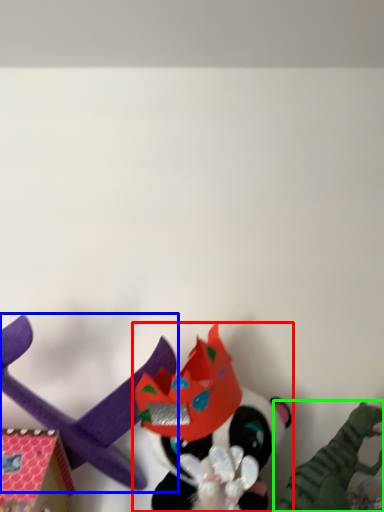
Question: Considering the real-world distances, which object is closest to toy (highlighted by a red box)? toy (highlighted by a blue box) or toy (highlighted by a green box).

Choices:
 (A) toy
 (B) toy

Answer: (A)